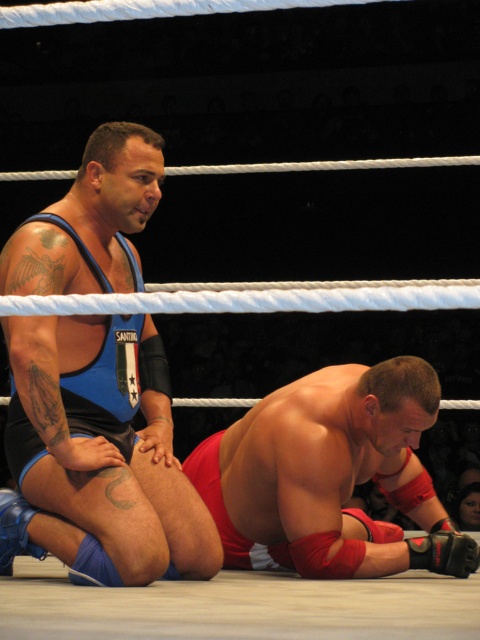
You are a referee in a wrestling match and need to determine if the blue fabric singlet at left is touching the smooth red wrestling mat at lower center. Given that the minimum distance required for touching is 1 inch, what is your ruling?

The blue fabric singlet at left and smooth red wrestling mat at lower center are 20.69 inches apart from each other. Since the distance is greater than the 1 inch requirement, the singlet is not touching the mat.

Based on the scene description, which object is bigger in size between the blue fabric singlet at left and the smooth red wrestling mat at lower center?

The blue fabric singlet at left is larger in size than the smooth red wrestling mat at lower center according to the description.

You are a referee observing the wrestlers in the ring. You notice the blue fabric singlet at left and the smooth red wrestling mat at lower center. Which object is positioned higher in the image?

The blue fabric singlet at left is located above the smooth red wrestling mat at lower center, so it is positioned higher in the image.